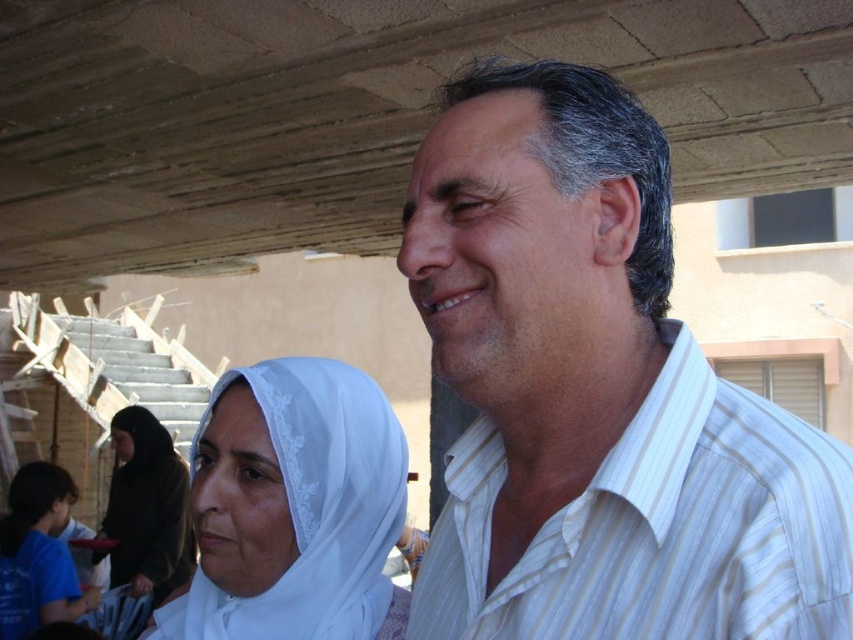
You are a photographer positioned in front of the unfinished roof structure. You want to take a photo that includes both the white striped shirt at upper right and the white lace hijab at lower left. Which object should you focus on first to ensure both are in sharp focus?

You should focus on the white striped shirt at upper right first because it is closer to the viewer than the white lace hijab at lower left, ensuring both will be in focus when focusing on the closer object.

You are an interior designer assessing the spatial compatibility of two decorative items in a room. The items are the white lace headscarf at center and the white lace hijab at lower left. If you want to place both on a shelf that can only accommodate the wider item, which one should you choose?

The white lace hijab at lower left is wider than the white lace headscarf at center, so you should choose the white lace hijab at lower left to place on the shelf since it is the wider item.

You are observing a construction site scene and notice two items in the image. One is the white striped shirt at upper right and the other is the white lace headscarf at center. Which of these two items appears taller in the image?

The white striped shirt at upper right appears taller than the white lace headscarf at center in the image.